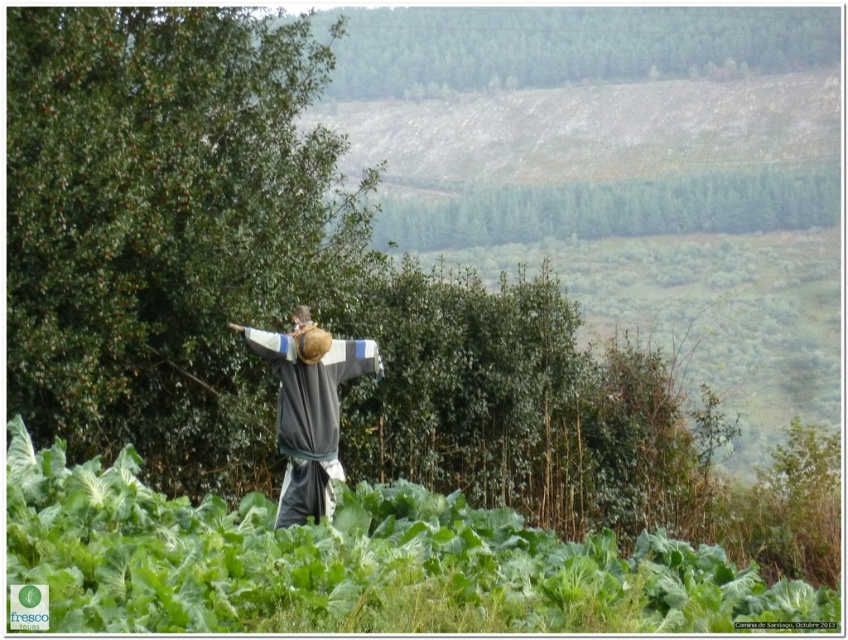
Does green leafy tree at center appear over gray fabric scarecrow at center?

Yes.

Does point (746, 179) come in front of point (358, 372)?

No, (746, 179) is behind (358, 372).

Which is in front, point (706, 218) or point (277, 352)?

Positioned in front is point (277, 352).

You are a GUI agent. You are given a task and a screenshot of the screen. Output one action in this format:
    pyautogui.click(x=<x>, y=<y>)
    Task: Click on the green leafy tree at center
    The width and height of the screenshot is (848, 640).
    Given the screenshot: What is the action you would take?
    pyautogui.click(x=614, y=209)

Does green leafy tree at left appear on the right side of green leafy tree at upper center?

In fact, green leafy tree at left is to the left of green leafy tree at upper center.

Who is shorter, green leafy tree at left or green leafy tree at upper center?

green leafy tree at upper center

Does point (240, 420) come closer to viewer compared to point (342, 10)?

Yes, point (240, 420) is in front of point (342, 10).

This screenshot has height=640, width=848. What are the coordinates of `green leafy tree at left` in the screenshot? It's located at (165, 227).

Does green leafy tree at left appear over green leafy tree at center?

No.

Measure the distance between green leafy tree at left and camera.

green leafy tree at left and camera are 30.82 feet apart.

This screenshot has width=848, height=640. What are the coordinates of `green leafy tree at left` in the screenshot? It's located at (165, 227).